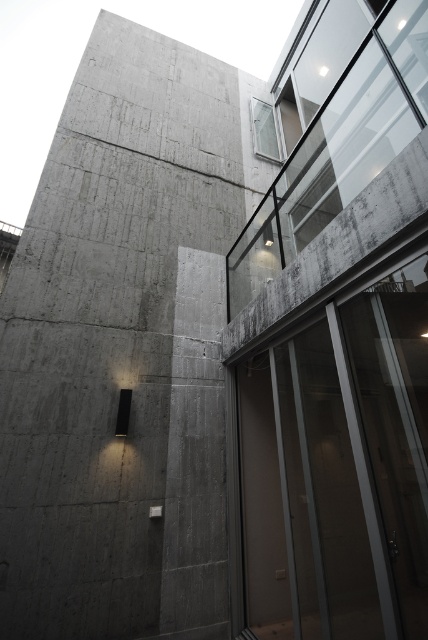
You are standing in front of the building and want to enter through the transparent glass door at center. Which side of the gray concrete wall at left should you walk around to reach the door?

You should walk around the right side of the gray concrete wall at left to reach the transparent glass door at center since the gray concrete wall at left is positioned to the left of the door.

You are standing in the modern architectural scene and want to locate the gray concrete wall at left. According to the coordinates provided, where would you find it?

The gray concrete wall at left is located at coordinates point (124, 348).